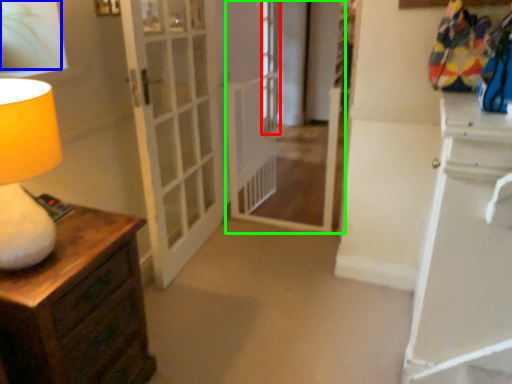
Question: Which object is the farthest from window (highlighted by a red box)? Choose among these: plant (highlighted by a blue box) or passage (highlighted by a green box).

Choices:
 (A) plant
 (B) passage

Answer: (A)